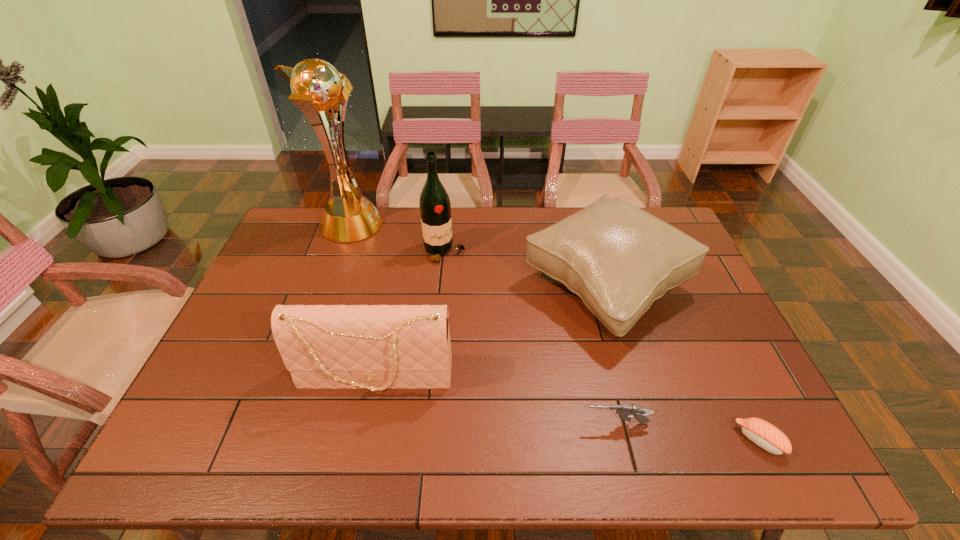
This screenshot has width=960, height=540. Identify the location of trophy. (316, 86).

Image resolution: width=960 pixels, height=540 pixels. Identify the location of the second tallest object. (435, 209).

Where is `the fourth farthest object`? This screenshot has height=540, width=960. the fourth farthest object is located at coordinates pyautogui.click(x=376, y=347).

I want to click on cushion, so click(x=618, y=258).

The height and width of the screenshot is (540, 960). Identify the location of gun. (624, 411).

Locate an element on the screen. This screenshot has height=540, width=960. sushi is located at coordinates (765, 435).

In order to click on vacant space located 0.320m on the front-facing side of the trophy in this screenshot , I will do `click(471, 225)`.

In order to click on free space located on the front of the wine bottle in this screenshot , I will do `click(434, 367)`.

Locate an element on the screen. vacant area located 0.150m on the front-facing side of the third nearest object is located at coordinates (358, 464).

Locate an element on the screen. vacant space located on the left of the cushion is located at coordinates (422, 286).